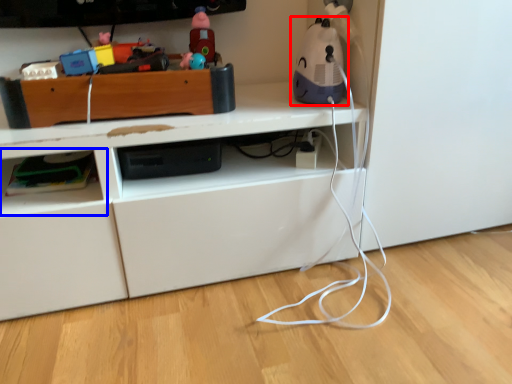
Question: Which of the following is the closest to the observer, toy (highlighted by a red box) or shelf (highlighted by a blue box)?

Choices:
 (A) toy
 (B) shelf

Answer: (A)